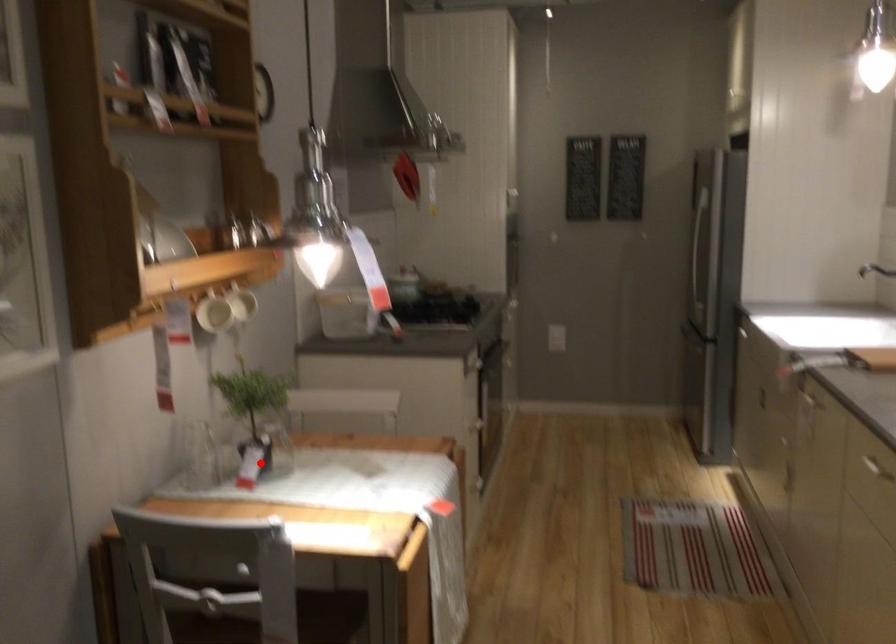
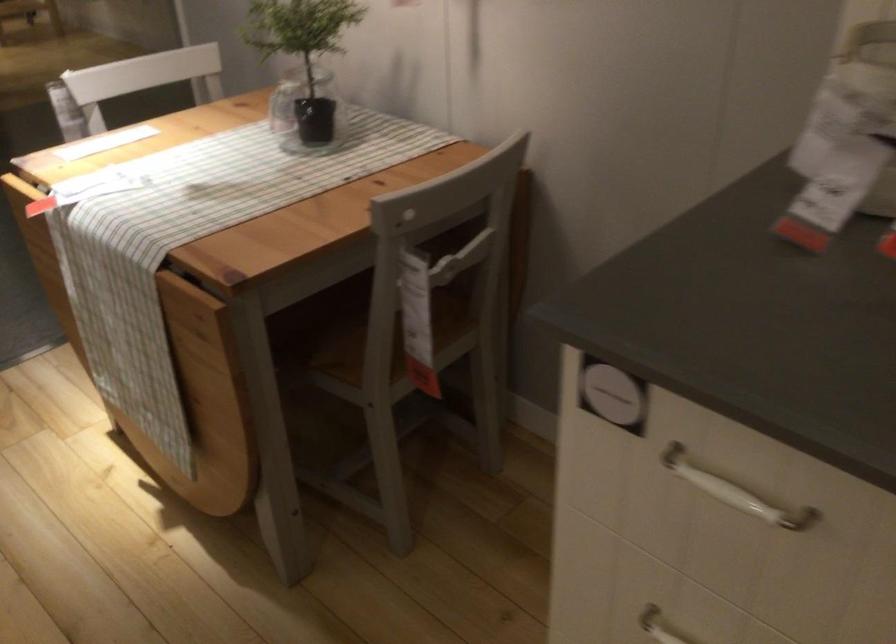
Question: I am providing you with two images of the same scene from different viewpoints. Given a red point in image1, look at the same physical point in image2. Is it:

Choices:
 (A) Closer to the viewpoint
 (B) Farther from the viewpoint

Answer: (A)